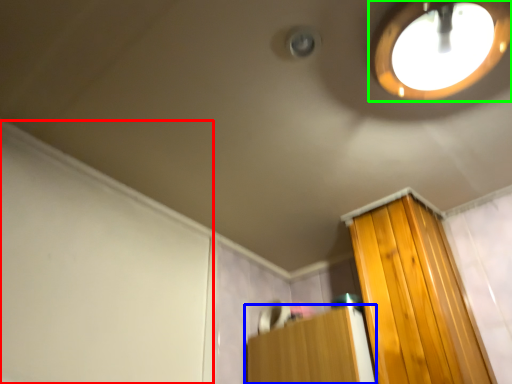
Question: Which object is the closest to the screen door (highlighted by a red box)? Choose among these: furniture (highlighted by a blue box) or droplight (highlighted by a green box).

Choices:
 (A) furniture
 (B) droplight

Answer: (A)